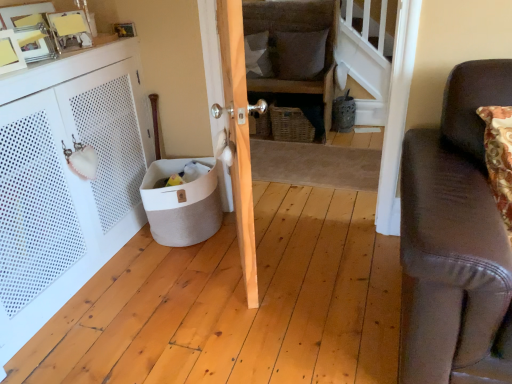
This screenshot has width=512, height=384. What are the coordinates of `beige fabric basket at lower left` in the screenshot? It's located at (182, 203).

Describe the element at coordinates (67, 180) in the screenshot. This screenshot has width=512, height=384. I see `white perforated cabinet at left` at that location.

This screenshot has width=512, height=384. Describe the element at coordinates (301, 54) in the screenshot. I see `white fabric pillow at center, the 2th pillow viewed from the left` at that location.

Identify the location of wooden door at center. Image resolution: width=512 pixels, height=384 pixels. (238, 136).

In order to click on beige fabric basket at lower left in this screenshot , I will do `click(182, 203)`.

From a real-world perspective, who is located lower, white perforated cabinet at left or textured gray pillow at upper center, marked as the 2th pillow in a right-to-left arrangement?

In real-world perspective, white perforated cabinet at left is lower.

From the white perforated cabinet at left, count 2nd pillows backward and point to it. Please provide its 2D coordinates.

[(258, 55)]

Which object is positioned more to the left, woven wicker basket at center or textured gray pillow at upper center, marked as the 2th pillow in a right-to-left arrangement?

textured gray pillow at upper center, marked as the 2th pillow in a right-to-left arrangement.

Between woven wicker basket at center and textured gray pillow at upper center, which appears as the 1th pillow when viewed from the left, which one has more height?

Standing taller between the two is woven wicker basket at center.

From a real-world perspective, which object rests below the other?

In real-world perspective, woven wicker basket at center is lower.

Is woven wicker basket at center thinner than textured gray pillow at upper center, which appears as the 1th pillow when viewed from the left?

No, woven wicker basket at center is not thinner than textured gray pillow at upper center, which appears as the 1th pillow when viewed from the left.

How far apart are beige fabric basket at lower left and white fabric pillow at center, the 2th pillow viewed from the left?

beige fabric basket at lower left is 1.60 meters from white fabric pillow at center, the 2th pillow viewed from the left.

Between beige fabric basket at lower left and white fabric pillow at center, which is counted as the 1th pillow, starting from the right, which one has larger size?

beige fabric basket at lower left.

Is beige fabric basket at lower left situated inside white fabric pillow at center, the 2th pillow viewed from the left, or outside?

beige fabric basket at lower left lies outside white fabric pillow at center, the 2th pillow viewed from the left.

Which pillow is the 1st one when counting from the back of the beige fabric basket at lower left? Please provide its 2D coordinates.

[(301, 54)]

From the image's perspective, is woven wicker basket at center on white perforated cabinet at left?

Correct, woven wicker basket at center appears higher than white perforated cabinet at left in the image.

Which of these two, woven wicker basket at center or white perforated cabinet at left, stands shorter?

white perforated cabinet at left.

This screenshot has width=512, height=384. I want to click on cabinetry in front of the woven wicker basket at center, so click(x=67, y=180).

Which of these two, woven wicker basket at center or white perforated cabinet at left, is bigger?

woven wicker basket at center.

From the picture: In terms of width, does wooden door at center look wider or thinner when compared to white fabric pillow at center, the 2th pillow viewed from the left?

In the image, wooden door at center appears to be wider than white fabric pillow at center, the 2th pillow viewed from the left.

Is wooden door at center oriented away from white fabric pillow at center, which is counted as the 1th pillow, starting from the right?

wooden door at center is not turned away from white fabric pillow at center, which is counted as the 1th pillow, starting from the right.

Are wooden door at center and white fabric pillow at center, which is counted as the 1th pillow, starting from the right, far apart?

Yes.

Considering the positions of points (224, 111) and (298, 42), is point (224, 111) farther from camera compared to point (298, 42)?

That is False.

Could you measure the distance between textured gray pillow at upper center, marked as the 2th pillow in a right-to-left arrangement, and white fabric pillow at center, the 2th pillow viewed from the left?

The distance of textured gray pillow at upper center, marked as the 2th pillow in a right-to-left arrangement, from white fabric pillow at center, the 2th pillow viewed from the left, is 10.16 inches.

Considering the sizes of textured gray pillow at upper center, marked as the 2th pillow in a right-to-left arrangement, and white fabric pillow at center, the 2th pillow viewed from the left, in the image, is textured gray pillow at upper center, marked as the 2th pillow in a right-to-left arrangement, wider or thinner than white fabric pillow at center, the 2th pillow viewed from the left,?

textured gray pillow at upper center, marked as the 2th pillow in a right-to-left arrangement, is wider than white fabric pillow at center, the 2th pillow viewed from the left.

From a real-world perspective, is textured gray pillow at upper center, which appears as the 1th pillow when viewed from the left, above or below white fabric pillow at center, the 2th pillow viewed from the left?

textured gray pillow at upper center, which appears as the 1th pillow when viewed from the left, is situated lower than white fabric pillow at center, the 2th pillow viewed from the left, in the real world.

Is textured gray pillow at upper center, marked as the 2th pillow in a right-to-left arrangement, at the right side of white fabric pillow at center, which is counted as the 1th pillow, starting from the right?

No, textured gray pillow at upper center, marked as the 2th pillow in a right-to-left arrangement, is not to the right of white fabric pillow at center, which is counted as the 1th pillow, starting from the right.

Is beige fabric basket at lower left oriented towards textured gray pillow at upper center, marked as the 2th pillow in a right-to-left arrangement?

No, beige fabric basket at lower left is not oriented towards textured gray pillow at upper center, marked as the 2th pillow in a right-to-left arrangement.

Which of these two, beige fabric basket at lower left or textured gray pillow at upper center, which appears as the 1th pillow when viewed from the left, is wider?

beige fabric basket at lower left.

Does beige fabric basket at lower left appear on the left side of textured gray pillow at upper center, which appears as the 1th pillow when viewed from the left?

Yes.

Considering the relative sizes of beige fabric basket at lower left and textured gray pillow at upper center, marked as the 2th pillow in a right-to-left arrangement, in the image provided, is beige fabric basket at lower left smaller than textured gray pillow at upper center, marked as the 2th pillow in a right-to-left arrangement,?

No, beige fabric basket at lower left is not smaller than textured gray pillow at upper center, marked as the 2th pillow in a right-to-left arrangement.

You are a GUI agent. You are given a task and a screenshot of the screen. Output one action in this format:
    pyautogui.click(x=<x>, y=<y>)
    Task: Click on the 1st pillow to the right when counting from the white perforated cabinet at left
    The width and height of the screenshot is (512, 384).
    Given the screenshot: What is the action you would take?
    pyautogui.click(x=258, y=55)

Identify the location of the 2nd pillow positioned above the woven wicker basket at center (from the image's perspective). Image resolution: width=512 pixels, height=384 pixels. (258, 55).

Considering their positions, is textured gray pillow at upper center, which appears as the 1th pillow when viewed from the left, positioned closer to woven brown basket at center than woven wicker basket at center?

woven wicker basket at center is closer to woven brown basket at center.

Looking at the image, which one is located further to white fabric pillow at center, which is counted as the 1th pillow, starting from the right, white perforated cabinet at left or beige fabric basket at lower left?

Based on the image, white perforated cabinet at left appears to be further to white fabric pillow at center, which is counted as the 1th pillow, starting from the right.

Based on their spatial positions, is white perforated cabinet at left or woven brown basket at center further from textured gray pillow at upper center, which appears as the 1th pillow when viewed from the left?

white perforated cabinet at left.

Which object lies nearer to the anchor point woven wicker basket at center, woven brown basket at center or white perforated cabinet at left?

Among the two, woven brown basket at center is located nearer to woven wicker basket at center.

From the image, which object appears to be nearer to wooden door at center, woven brown basket at center or beige fabric basket at lower left?

beige fabric basket at lower left lies closer to wooden door at center than the other object.

Looking at the image, which one is located closer to textured gray pillow at upper center, marked as the 2th pillow in a right-to-left arrangement, white perforated cabinet at left or wooden door at center?

white perforated cabinet at left lies closer to textured gray pillow at upper center, marked as the 2th pillow in a right-to-left arrangement, than the other object.

When comparing their distances from white perforated cabinet at left, does woven wicker basket at center or wooden door at center seem closer?

wooden door at center.

From the image, which object appears to be farther from textured gray pillow at upper center, marked as the 2th pillow in a right-to-left arrangement, woven wicker basket at center or white fabric pillow at center, which is counted as the 1th pillow, starting from the right?

Among the two, woven wicker basket at center is located further to textured gray pillow at upper center, marked as the 2th pillow in a right-to-left arrangement.

Where is `door between white perforated cabinet at left and woven brown basket at center along the z-axis`? The image size is (512, 384). door between white perforated cabinet at left and woven brown basket at center along the z-axis is located at coordinates (238, 136).

Identify the location of door between white perforated cabinet at left and white fabric pillow at center, the 2th pillow viewed from the left, along the z-axis. (238, 136).

Find the location of a particular element. The width and height of the screenshot is (512, 384). chair between white perforated cabinet at left and textured gray pillow at upper center, which appears as the 1th pillow when viewed from the left, from front to back is located at coordinates (298, 55).

I want to click on pillow located between white perforated cabinet at left and textured gray pillow at upper center, which appears as the 1th pillow when viewed from the left, in the depth direction, so click(x=301, y=54).